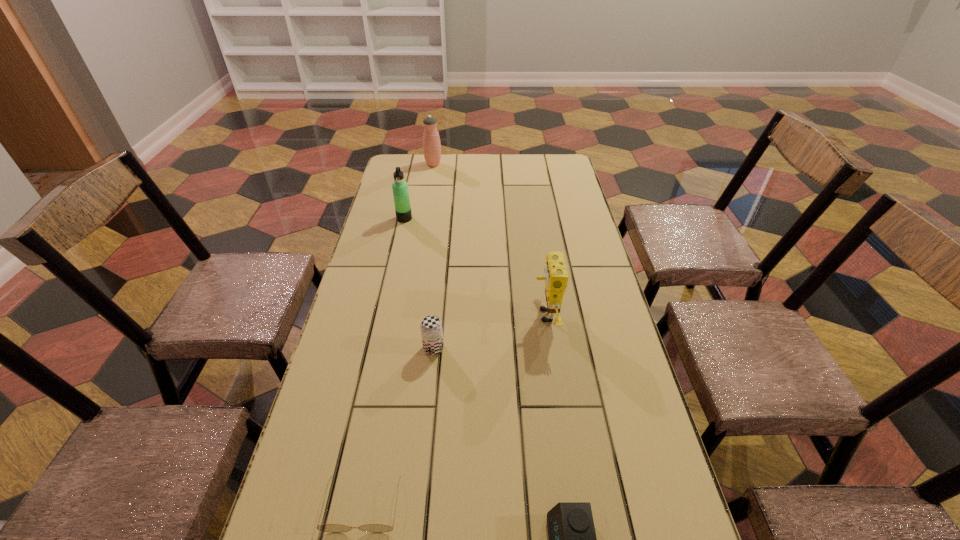
In order to click on vacant area located 0.200m on the face of the sponge in this screenshot , I will do click(x=462, y=315).

Locate an element on the screen. This screenshot has height=540, width=960. free space located on the face of the sponge is located at coordinates (493, 315).

The height and width of the screenshot is (540, 960). I want to click on free space located 0.170m on the face of the sponge, so click(472, 315).

At what (x,y) coordinates should I click in order to perform the action: click on blank space located 0.090m on the back of the third object from right to left. Please return your answer as a coordinate pair (x, y). The width and height of the screenshot is (960, 540). Looking at the image, I should click on (437, 315).

This screenshot has width=960, height=540. I want to click on object present at the far edge, so click(431, 141).

In order to click on sunglasses present at the left edge in this screenshot , I will do `click(332, 528)`.

Image resolution: width=960 pixels, height=540 pixels. I want to click on object at the far left corner, so click(431, 141).

Identify the location of vacant space at the far edge of the desktop. (521, 164).

In the image, there is a desktop. Where is `free region at the left edge`? The width and height of the screenshot is (960, 540). free region at the left edge is located at coordinates (383, 231).

I want to click on vacant space at the right edge, so click(598, 287).